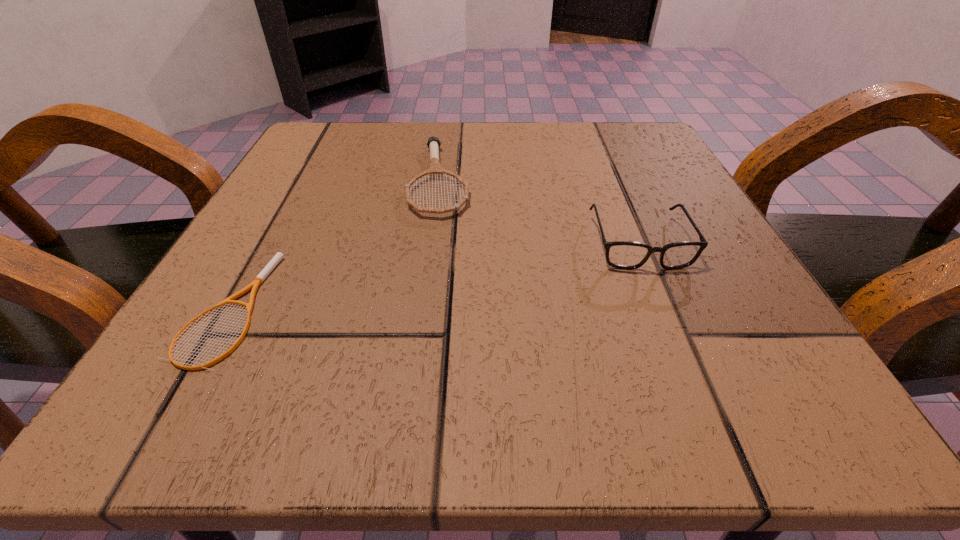
This screenshot has width=960, height=540. What are the coordinates of `object at the near edge` in the screenshot? It's located at (258, 280).

You are a GUI agent. You are given a task and a screenshot of the screen. Output one action in this format:
    pyautogui.click(x=<x>, y=<y>)
    Task: Click on the object present at the left edge
    
    Given the screenshot: What is the action you would take?
    pyautogui.click(x=258, y=280)

The width and height of the screenshot is (960, 540). Find the location of `object positioned at the right edge`. object positioned at the right edge is located at coordinates (628, 255).

At what (x,y) coordinates should I click in order to perform the action: click on object situated at the near left corner. Please return your answer as a coordinate pair (x, y). The height and width of the screenshot is (540, 960). Looking at the image, I should click on (258, 280).

At what (x,y) coordinates should I click in order to perform the action: click on vacant area at the far edge. Please return your answer as a coordinate pair (x, y). Looking at the image, I should click on (402, 137).

This screenshot has height=540, width=960. In the image, there is a desktop. What are the coordinates of `vacant region at the left edge` in the screenshot? It's located at (321, 309).

The height and width of the screenshot is (540, 960). What are the coordinates of `free space at the right edge of the desktop` in the screenshot? It's located at (703, 349).

In the image, there is a desktop. Identify the location of vacant space at the far left corner. click(380, 141).

Find the location of a particular element. free space at the near left corner of the desktop is located at coordinates (260, 371).

Find the location of a particular element. This screenshot has height=540, width=960. vacant space at the far right corner is located at coordinates (607, 130).